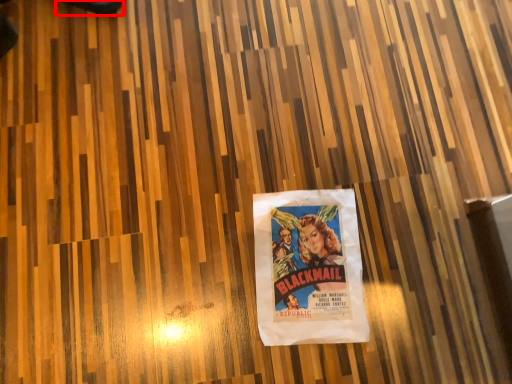
Question: From the image's perspective, what is the correct spatial relationship of shoe (annotated by the red box) in relation to poster?

Choices:
 (A) below
 (B) above

Answer: (B)